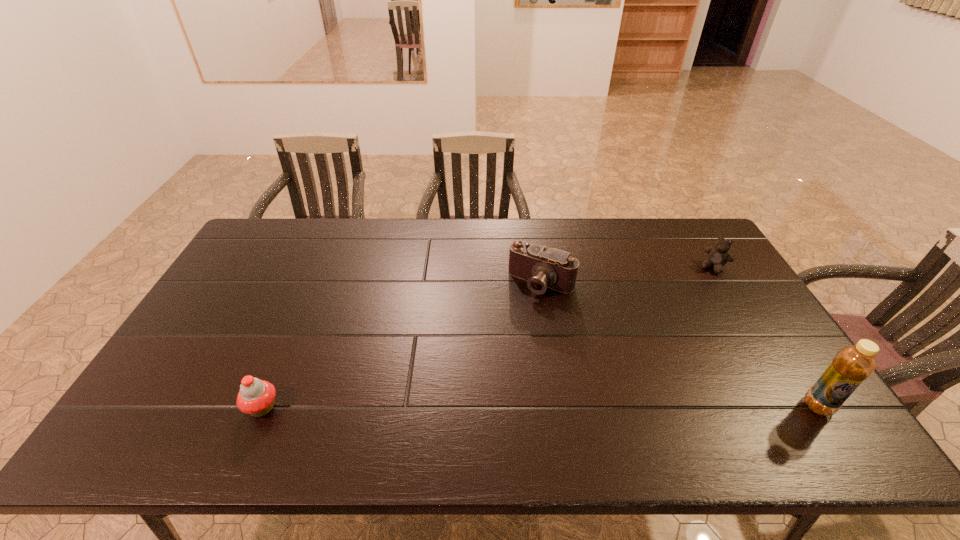
You are a GUI agent. You are given a task and a screenshot of the screen. Output one action in this format:
    pyautogui.click(x=<x>, y=<y>)
    Task: Click on the cupcake
    
    Given the screenshot: What is the action you would take?
    pyautogui.click(x=256, y=397)

Where is `bottle`? The width and height of the screenshot is (960, 540). bottle is located at coordinates (852, 365).

Where is `teddy bear`? The width and height of the screenshot is (960, 540). teddy bear is located at coordinates (718, 256).

This screenshot has width=960, height=540. I want to click on camera, so click(542, 267).

You are a GUI agent. You are given a task and a screenshot of the screen. Output one action in this format:
    pyautogui.click(x=<x>, y=<y>)
    Task: Click on the free point located 0.170m on the right of the leftmost object
    The width and height of the screenshot is (960, 540).
    Given the screenshot: What is the action you would take?
    pyautogui.click(x=350, y=407)

This screenshot has height=540, width=960. Identify the location of vacant space located 0.330m on the left of the tallest object. (668, 406).

This screenshot has height=540, width=960. Find the location of `vacant space located on the face of the teddy bear`. vacant space located on the face of the teddy bear is located at coordinates (669, 331).

You are a GUI agent. You are given a task and a screenshot of the screen. Output one action in this format:
    pyautogui.click(x=<x>, y=<y>)
    Task: Click on the free region located 0.380m on the face of the teddy bear
    The height and width of the screenshot is (540, 960).
    Given the screenshot: What is the action you would take?
    pyautogui.click(x=661, y=341)

Locate an element on the screen. Image resolution: width=960 pixels, height=540 pixels. vacant area situated on the face of the teddy bear is located at coordinates (663, 339).

Identify the location of free location located 0.100m on the front-facing side of the camera. The image size is (960, 540). tap(515, 321).